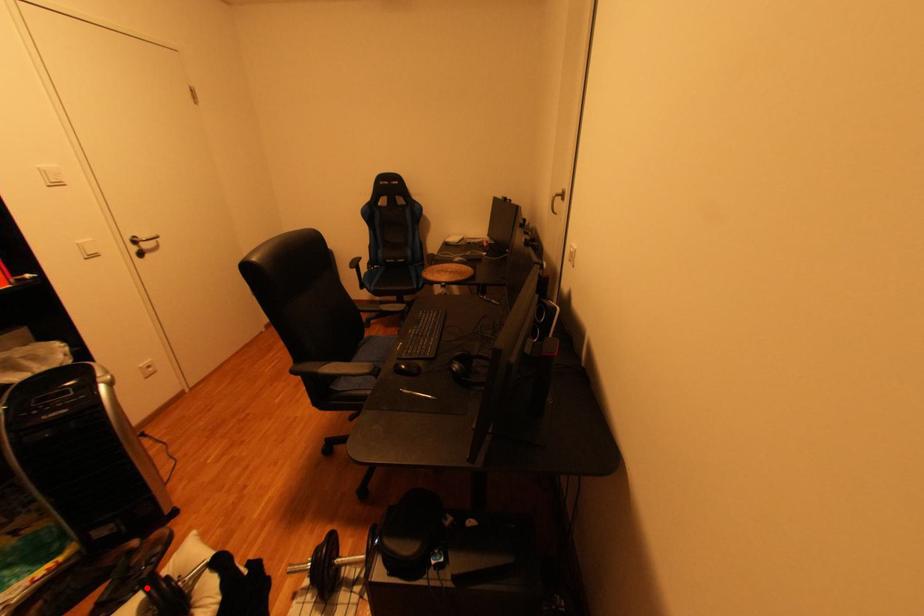
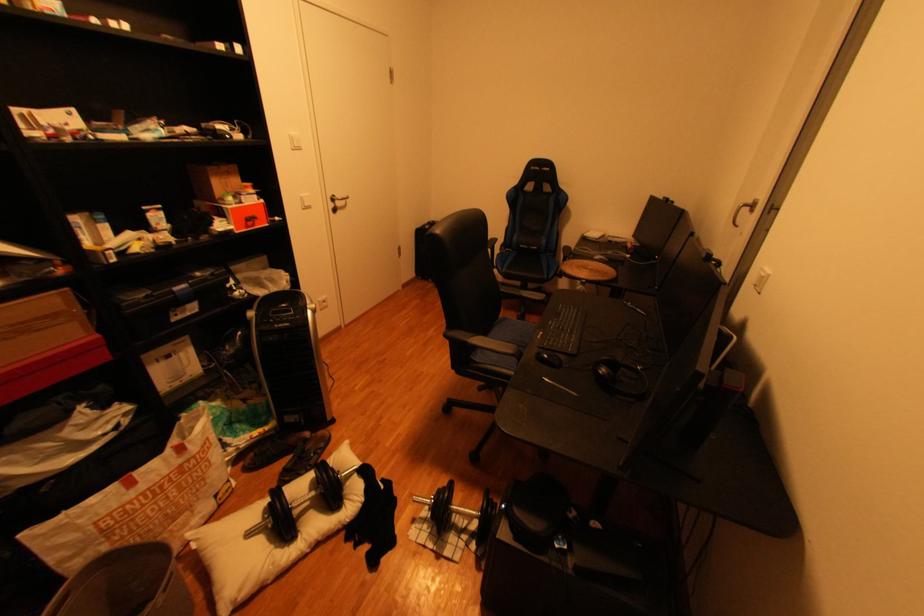
In the second image, find the point that corresponds to the highlighted location in the first image.

(318, 468)